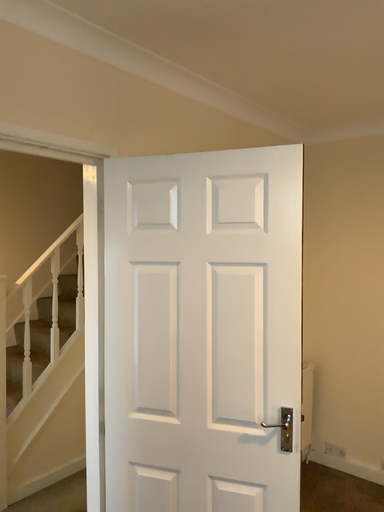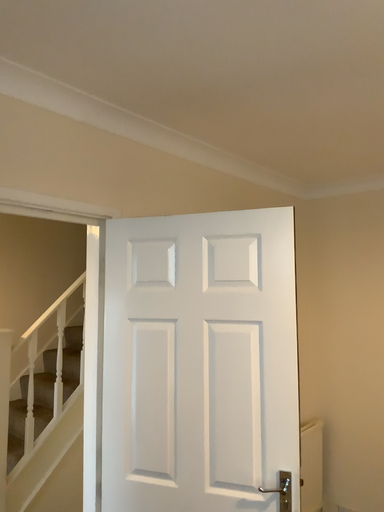
Question: How did the camera likely rotate when shooting the video?

Choices:
 (A) rotated upward
 (B) rotated downward

Answer: (A)